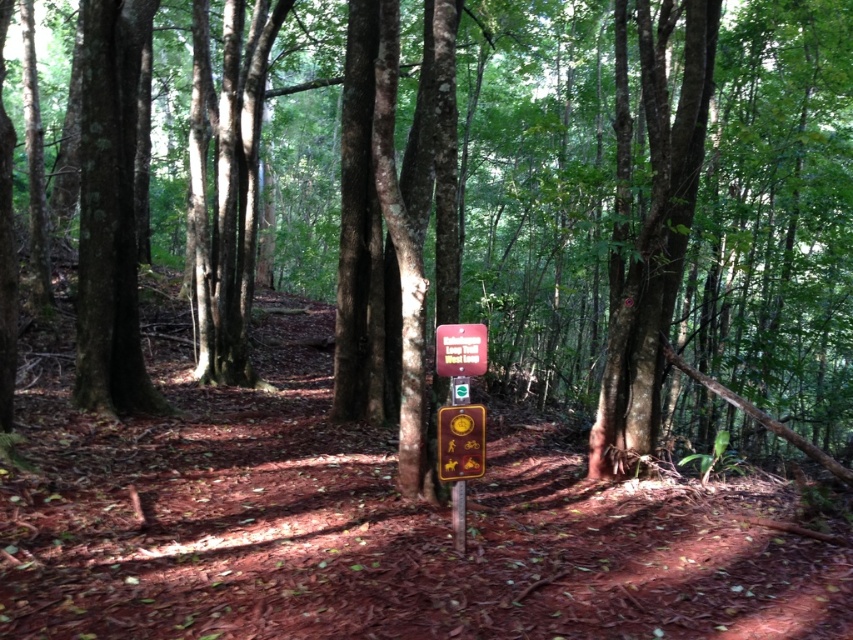
Is metallic gold sign at center smaller than wooden sign at center?

Yes, metallic gold sign at center is smaller than wooden sign at center.

Does point (467, 444) come farther from viewer compared to point (450, 355)?

No, it is not.

The height and width of the screenshot is (640, 853). What are the coordinates of `metallic gold sign at center` in the screenshot? It's located at (460, 442).